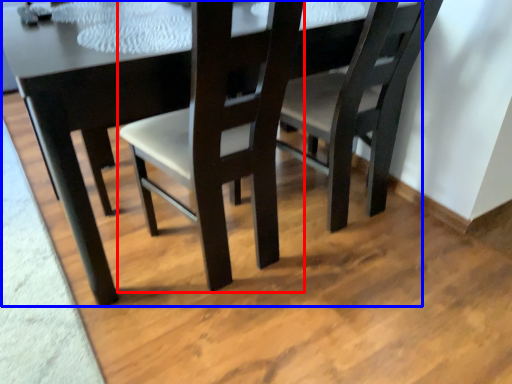
Question: Among these objects, which one is nearest to the camera, chair (highlighted by a red box) or table (highlighted by a blue box)?

Choices:
 (A) chair
 (B) table

Answer: (A)